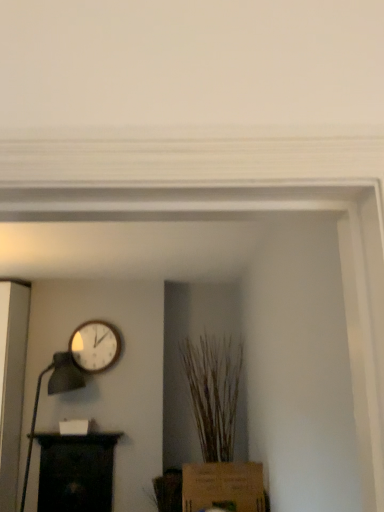
Question: Is brown textured plant at center aimed at brown cardboard box at lower center?

Choices:
 (A) no
 (B) yes

Answer: (B)

Question: Is brown textured plant at center further to the viewer compared to brown cardboard box at lower center?

Choices:
 (A) no
 (B) yes

Answer: (B)

Question: Is brown textured plant at center at the left side of brown cardboard box at lower center?

Choices:
 (A) yes
 (B) no

Answer: (B)

Question: From the image's perspective, is brown textured plant at center over brown cardboard box at lower center?

Choices:
 (A) yes
 (B) no

Answer: (A)

Question: Is brown textured plant at center taller than brown cardboard box at lower center?

Choices:
 (A) yes
 (B) no

Answer: (A)

Question: Is brown textured plant at center turned away from brown cardboard box at lower center?

Choices:
 (A) no
 (B) yes

Answer: (A)

Question: Is brown textured plant at center not close to black wood shelf at lower left?

Choices:
 (A) yes
 (B) no

Answer: (B)

Question: Is brown textured plant at center wider than black wood shelf at lower left?

Choices:
 (A) yes
 (B) no

Answer: (A)

Question: Can you confirm if brown textured plant at center is taller than black wood shelf at lower left?

Choices:
 (A) no
 (B) yes

Answer: (B)

Question: Is brown textured plant at center at the left side of black wood shelf at lower left?

Choices:
 (A) no
 (B) yes

Answer: (A)

Question: From a real-world perspective, does brown textured plant at center sit lower than black wood shelf at lower left?

Choices:
 (A) yes
 (B) no

Answer: (B)

Question: Does brown textured plant at center contain black wood shelf at lower left?

Choices:
 (A) no
 (B) yes

Answer: (A)

Question: From a real-world perspective, is black wood shelf at lower left over matte black table lamp at left?

Choices:
 (A) yes
 (B) no

Answer: (B)